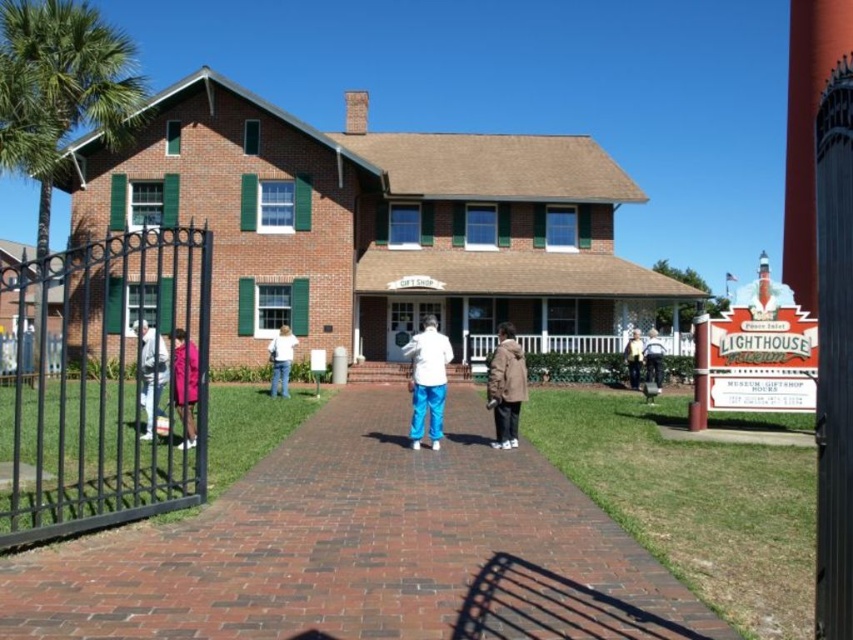
Which is more to the left, matte pink coat at left or brown leather jacket at center?

matte pink coat at left is more to the left.

Image resolution: width=853 pixels, height=640 pixels. What do you see at coordinates (152, 376) in the screenshot? I see `matte pink coat at left` at bounding box center [152, 376].

Locate an element on the screen. The image size is (853, 640). matte pink coat at left is located at coordinates (152, 376).

Is smooth red tower at upper right taller than white glossy door at center?

Correct, smooth red tower at upper right is much taller as white glossy door at center.

Consider the image. Does smooth red tower at upper right have a greater width compared to white glossy door at center?

Correct, the width of smooth red tower at upper right exceeds that of white glossy door at center.

Is point (827, 6) behind point (392, 352)?

That is True.

What are the coordinates of `smooth red tower at upper right` in the screenshot? It's located at (807, 131).

Is point (68, 52) closer to viewer compared to point (276, 355)?

No.

Image resolution: width=853 pixels, height=640 pixels. Identify the location of green leafy palm tree at left. (57, 86).